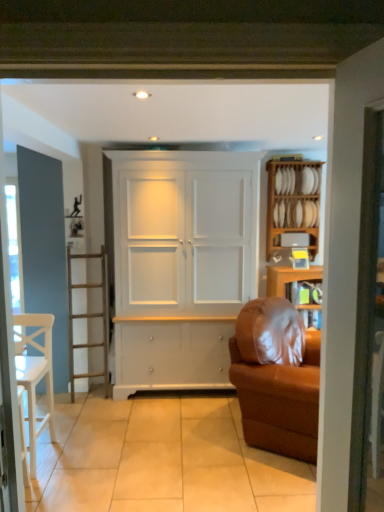
Question: Is white matte cabinet at center bigger or smaller than wooden plate rack at right, which is the second shelf from bottom to top?

Choices:
 (A) big
 (B) small

Answer: (A)

Question: Considering the relative positions of white matte cabinet at center and wooden plate rack at right, which is the 1th shelf from top to bottom, in the image provided, is white matte cabinet at center to the left or to the right of wooden plate rack at right, which is the 1th shelf from top to bottom,?

Choices:
 (A) right
 (B) left

Answer: (B)

Question: Which is farther from the white matte cabinet at center?

Choices:
 (A) white wooden shelf at upper right, the 2th shelf from the top
 (B) wooden plate rack at right, which is the 1th shelf from top to bottom
 (C) white wood chair at left
 (D) brown fabric couch at right

Answer: (A)

Question: Based on their relative distances, which object is nearer to the white matte cabinet at center?

Choices:
 (A) white wood chair at left
 (B) brown fabric couch at right
 (C) white wooden shelf at upper right, the 2th shelf from the top
 (D) wooden plate rack at right, which is the 1th shelf from top to bottom

Answer: (D)